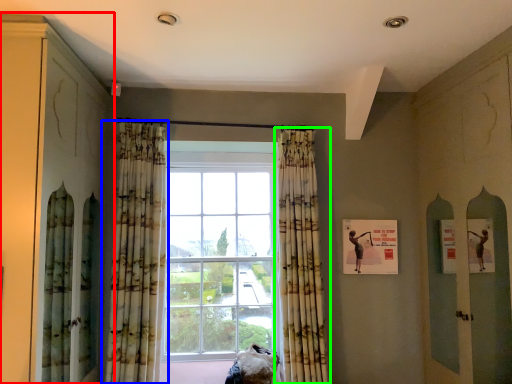
Question: Which object is positioned farthest from cabinetry (highlighted by a red box)? Select from curtain (highlighted by a blue box) and curtain (highlighted by a green box).

Choices:
 (A) curtain
 (B) curtain

Answer: (B)